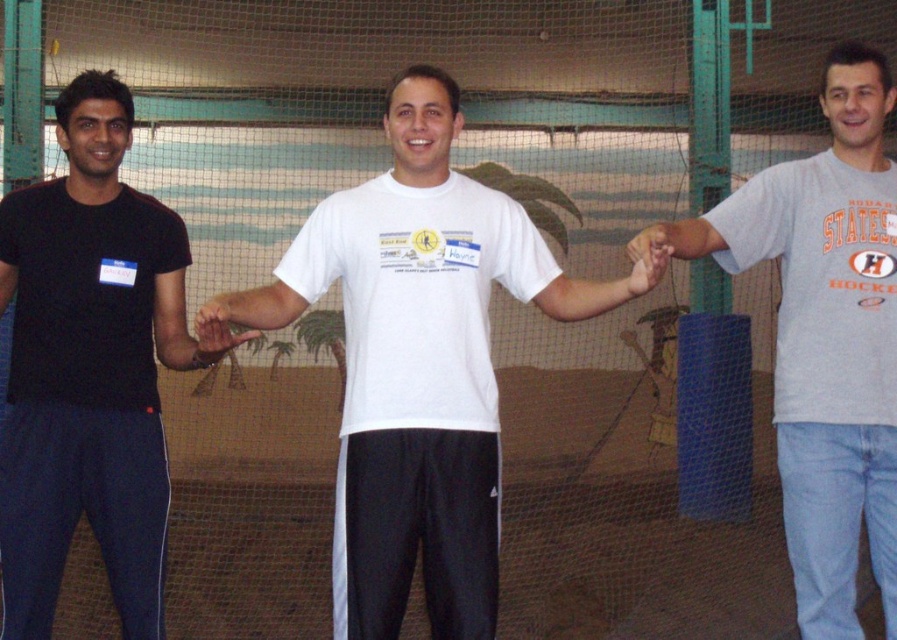
Is white matte t-shirt at center to the right of gray cotton t-shirt at right from the viewer's perspective?

Incorrect, white matte t-shirt at center is not on the right side of gray cotton t-shirt at right.

Is white matte t-shirt at center wider than gray cotton t-shirt at right?

→ Yes, white matte t-shirt at center is wider than gray cotton t-shirt at right.

Image resolution: width=897 pixels, height=640 pixels. Describe the element at coordinates (421, 364) in the screenshot. I see `white matte t-shirt at center` at that location.

Where is `white matte t-shirt at center`? white matte t-shirt at center is located at coordinates (421, 364).

Is gray cotton t-shirt at right behind matte white hand at center?

Yes, it is.

This screenshot has height=640, width=897. What are the coordinates of `gray cotton t-shirt at right` in the screenshot? It's located at (825, 337).

Is black matte t-shirt at left positioned behind matte white hand at center?

Yes, black matte t-shirt at left is behind matte white hand at center.

Can you confirm if black matte t-shirt at left is taller than matte white hand at center?

Correct, black matte t-shirt at left is much taller as matte white hand at center.

Is point (76, 291) closer to viewer compared to point (210, 346)?

That is False.

Where is `black matte t-shirt at left`? black matte t-shirt at left is located at coordinates (88, 369).